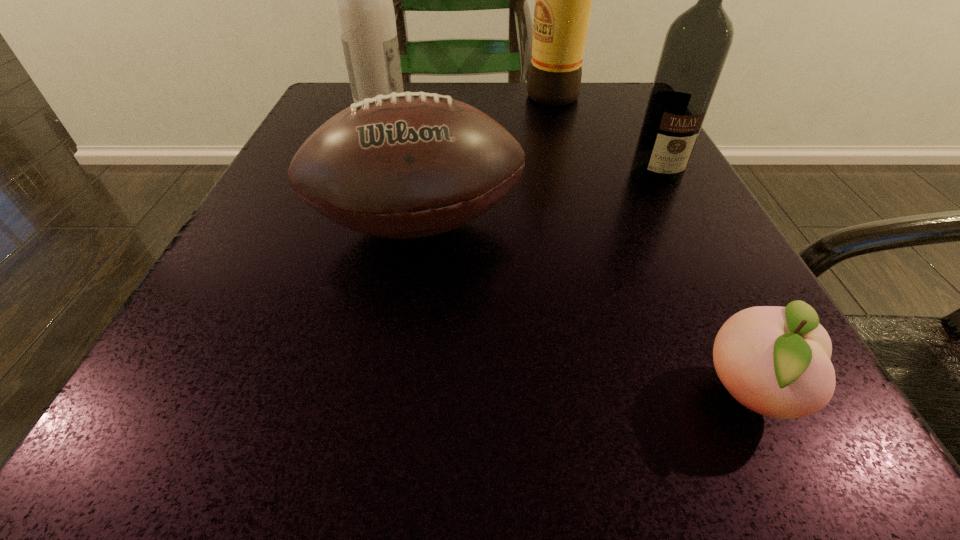
This screenshot has height=540, width=960. In order to click on free location located 0.090m on the front and back of the nearest alcohol in this screenshot , I will do `click(683, 226)`.

The height and width of the screenshot is (540, 960). Find the location of `free location located 0.220m on the right of the football (American)`. free location located 0.220m on the right of the football (American) is located at coordinates (681, 227).

Find the location of a particular element. free spot located on the back of the peach is located at coordinates (670, 231).

Locate an element on the screen. object situated at the near edge is located at coordinates (774, 360).

This screenshot has height=540, width=960. Find the location of `alcohol that is at the left edge`. alcohol that is at the left edge is located at coordinates (364, 7).

In order to click on football (American) at the left edge in this screenshot , I will do `click(404, 165)`.

The image size is (960, 540). Find the location of `peach situated at the right edge`. peach situated at the right edge is located at coordinates (774, 360).

You are a GUI agent. You are given a task and a screenshot of the screen. Output one action in this format:
    pyautogui.click(x=<x>, y=<y>)
    Task: Click on the object at the far left corner
    The height and width of the screenshot is (540, 960).
    Given the screenshot: What is the action you would take?
    pyautogui.click(x=364, y=7)

The width and height of the screenshot is (960, 540). In order to click on object located at the far right corner in this screenshot , I will do `click(563, 0)`.

Locate an element on the screen. The height and width of the screenshot is (540, 960). object present at the near right corner is located at coordinates (774, 360).